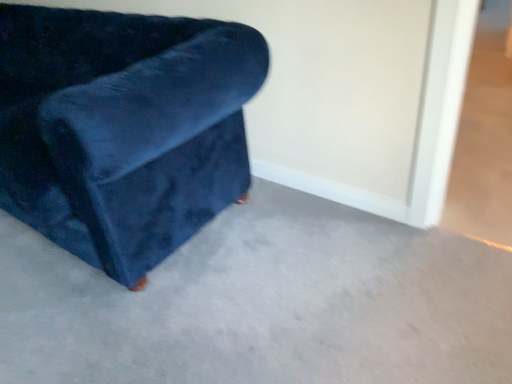
Question: Does velvet blue chair at left appear on the left side of velvet blue couch at left?

Choices:
 (A) yes
 (B) no

Answer: (A)

Question: Does velvet blue chair at left have a lesser width compared to velvet blue couch at left?

Choices:
 (A) yes
 (B) no

Answer: (A)

Question: Considering the relative sizes of velvet blue chair at left and velvet blue couch at left in the image provided, is velvet blue chair at left bigger than velvet blue couch at left?

Choices:
 (A) no
 (B) yes

Answer: (B)

Question: From the image's perspective, is velvet blue chair at left located beneath velvet blue couch at left?

Choices:
 (A) yes
 (B) no

Answer: (B)

Question: Can you confirm if velvet blue chair at left is wider than velvet blue couch at left?

Choices:
 (A) yes
 (B) no

Answer: (B)

Question: Are velvet blue chair at left and velvet blue couch at left located far from each other?

Choices:
 (A) yes
 (B) no

Answer: (B)

Question: Is velvet blue couch at left positioned behind velvet blue chair at left?

Choices:
 (A) no
 (B) yes

Answer: (A)

Question: Can you confirm if velvet blue couch at left is shorter than velvet blue chair at left?

Choices:
 (A) yes
 (B) no

Answer: (A)

Question: Is velvet blue couch at left facing towards velvet blue chair at left?

Choices:
 (A) no
 (B) yes

Answer: (A)

Question: Can you confirm if velvet blue couch at left is positioned to the left of velvet blue chair at left?

Choices:
 (A) yes
 (B) no

Answer: (B)

Question: Is velvet blue couch at left facing away from velvet blue chair at left?

Choices:
 (A) no
 (B) yes

Answer: (A)

Question: Is there a large distance between velvet blue couch at left and velvet blue chair at left?

Choices:
 (A) no
 (B) yes

Answer: (A)

Question: In terms of size, does velvet blue chair at left appear bigger or smaller than velvet blue couch at left?

Choices:
 (A) small
 (B) big

Answer: (B)